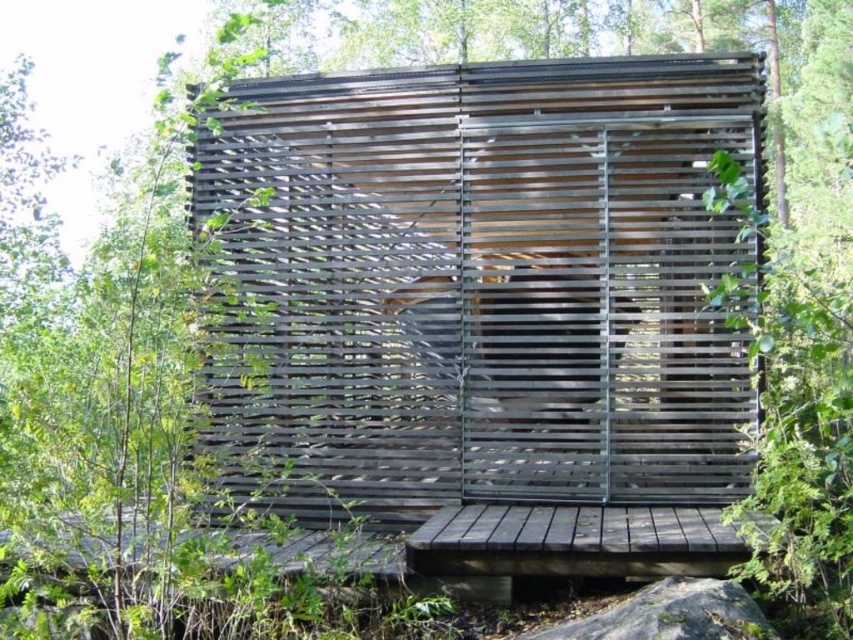
You are standing in front of the wooden structure and want to touch both the wooden slats at center and the gray rough rock at lower center. Which object will you reach first?

You will reach the wooden slats at center first because it is closer to you than the gray rough rock at lower center.

You are an architect designing a new eco cabin. You want to use the wooden slats at center and gray rough rock at lower center in your design. Which material would you choose if you want to emphasize the natural texture of the building?

The wooden slats at center has a larger size compared to gray rough rock at lower center, so using the wooden slats at center would emphasize the natural texture of the building due to their larger size and ability to create a patterned facade that blends with the surroundings.

You are standing on the wooden platform looking at the wooden slats at center and the gray rough rock at lower center. Which object is positioned higher from the ground?

The wooden slats at center is positioned higher from the ground than the gray rough rock at lower center because it is above it.